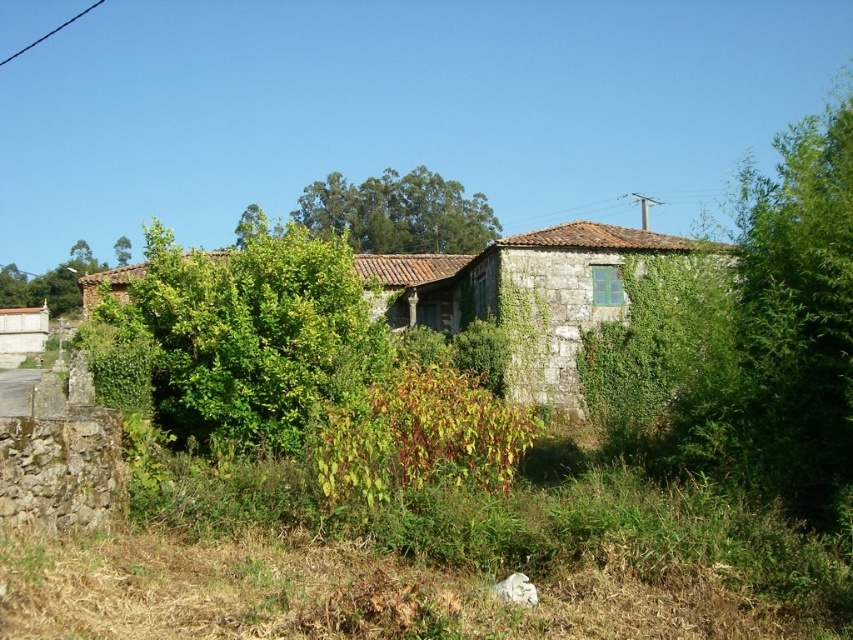
Does green leafy bush at center come behind green leafy tree at upper center?

No.

Between point (309, 400) and point (358, 188), which one is positioned behind?

The point (358, 188) is behind.

Identify the location of green leafy bush at center. Image resolution: width=853 pixels, height=640 pixels. (251, 332).

You are a GUI agent. You are given a task and a screenshot of the screen. Output one action in this format:
    pyautogui.click(x=<x>, y=<y>)
    Task: Click on the green leafy plant at center
    The image size is (853, 640).
    Given the screenshot: What is the action you would take?
    pyautogui.click(x=421, y=436)

Is green leafy plant at center taller than green leafy tree at upper left?

No.

Who is more distant from viewer, (339, 408) or (122, 241)?

The point (122, 241) is more distant.

In order to click on green leafy plant at center in this screenshot , I will do `click(421, 436)`.

The image size is (853, 640). What do you see at coordinates (251, 332) in the screenshot? I see `green leafy bush at center` at bounding box center [251, 332].

Does green leafy bush at center have a lesser height compared to green leafy plant at center?

Incorrect, green leafy bush at center's height does not fall short of green leafy plant at center's.

Is point (161, 360) closer to camera compared to point (436, 376)?

No, (161, 360) is behind (436, 376).

At what (x,y) coordinates should I click in order to perform the action: click on green leafy bush at center. Please return your answer as a coordinate pair (x, y). This screenshot has width=853, height=640. Looking at the image, I should click on (251, 332).